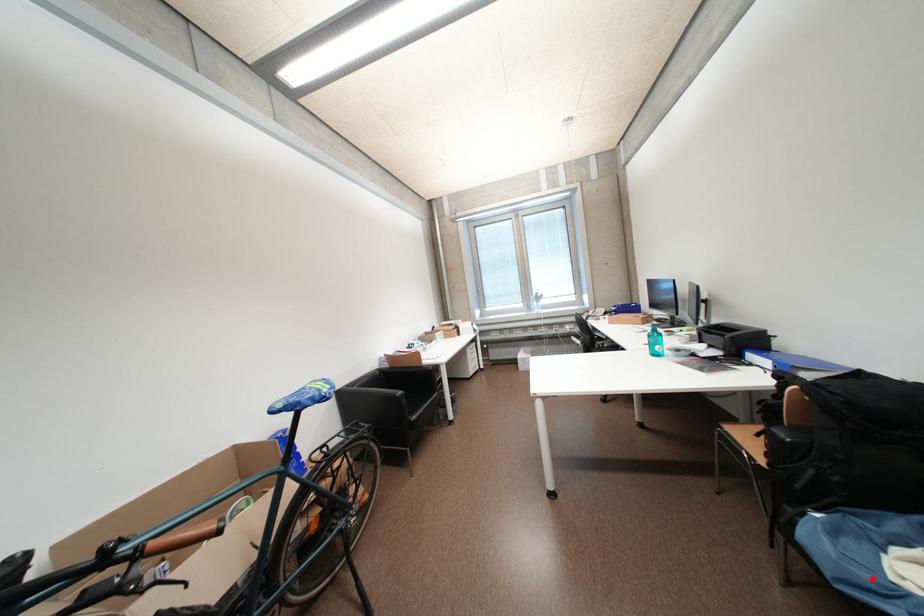
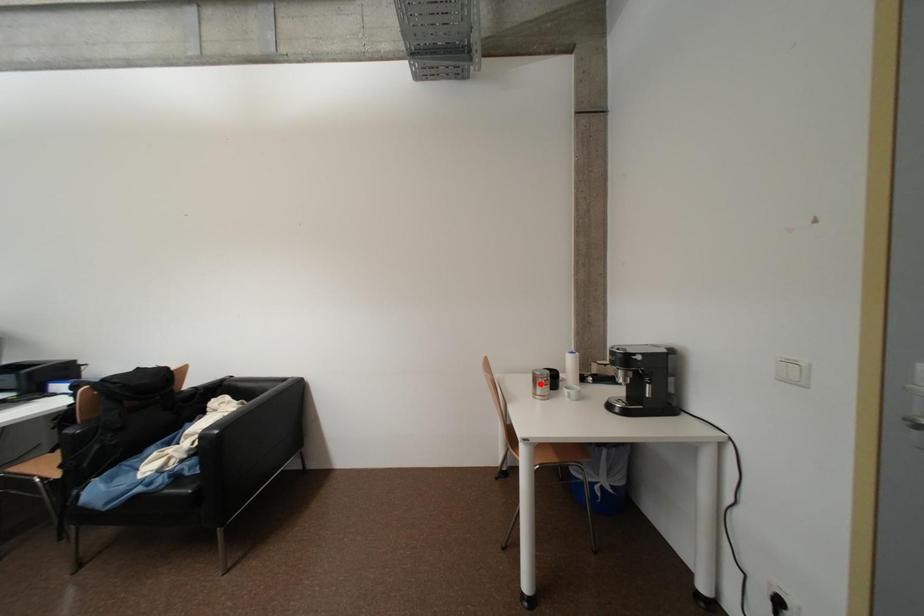
I am providing you with two images of the same scene from different viewpoints. A red point is marked on the first image and another point is marked on the second image. Does the point marked in image1 correspond to the same location as the one in image2?

No